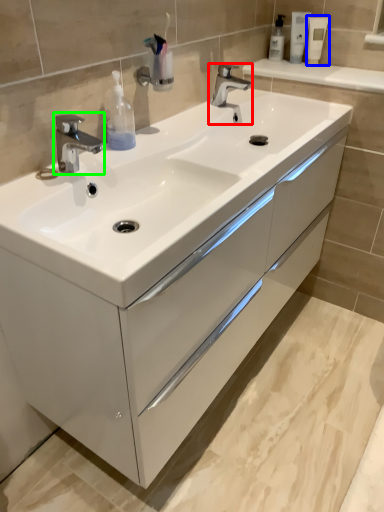
Question: Based on their relative distances, which object is farther from tap (highlighted by a red box)? Choose from mouthwash (highlighted by a blue box) and tap (highlighted by a green box).

Choices:
 (A) mouthwash
 (B) tap

Answer: (B)